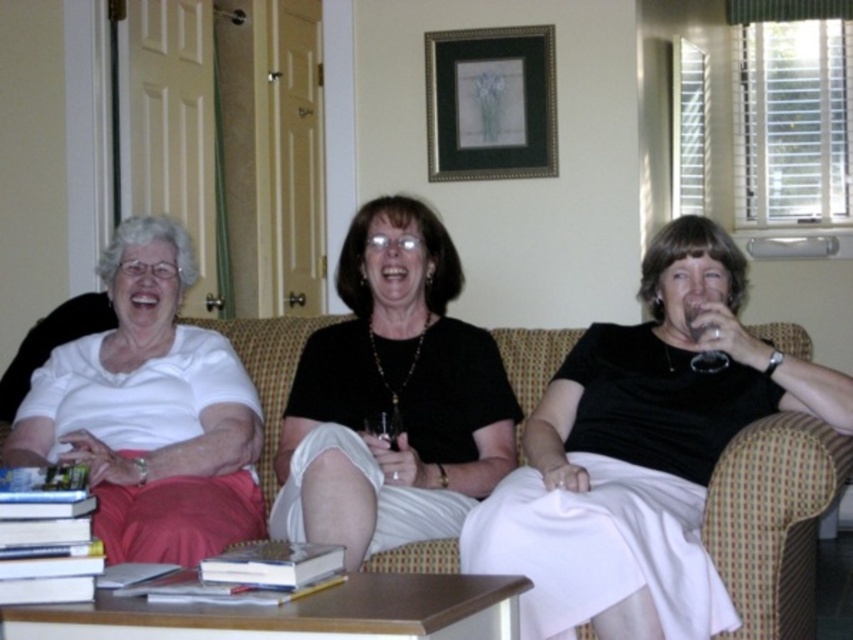
Does black matte dress at center have a greater width compared to black wooden picture frame at upper center?

Yes, black matte dress at center is wider than black wooden picture frame at upper center.

Is point (381, 257) positioned after point (514, 88)?

No, it is not.

What do you see at coordinates (392, 397) in the screenshot?
I see `black matte dress at center` at bounding box center [392, 397].

In order to click on black matte dress at center in this screenshot , I will do `click(392, 397)`.

Is white matte shirt at left below plush beige couch at center?

Incorrect, white matte shirt at left is not positioned below plush beige couch at center.

Who is positioned more to the right, white matte shirt at left or plush beige couch at center?

From the viewer's perspective, plush beige couch at center appears more on the right side.

What are the coordinates of `white matte shirt at left` in the screenshot? It's located at (149, 412).

Does black matte dress at center have a lesser height compared to white matte shirt at left?

In fact, black matte dress at center may be taller than white matte shirt at left.

Who is more forward, (357, 284) or (97, 486)?

Point (97, 486) is more forward.

Locate an element on the screen. The height and width of the screenshot is (640, 853). black matte dress at center is located at coordinates (392, 397).